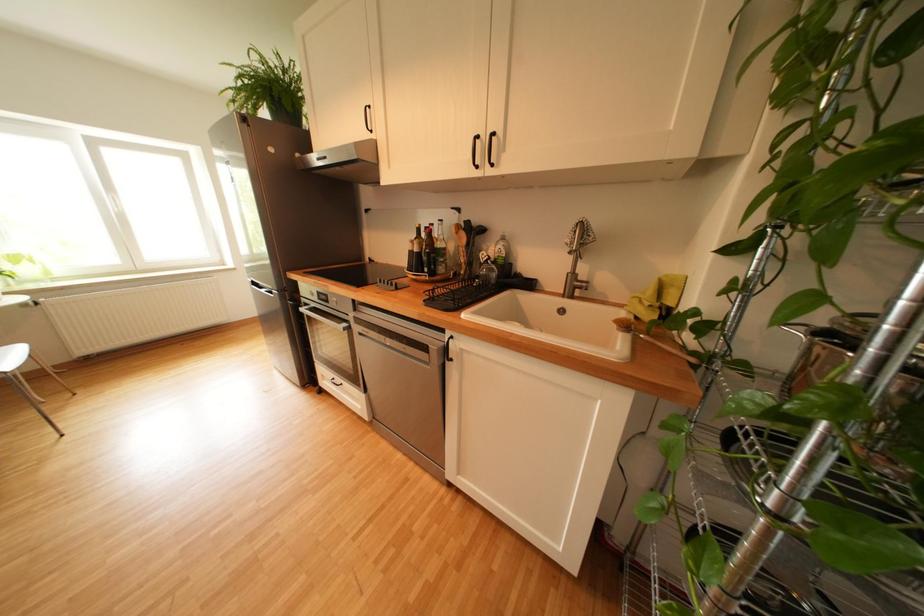
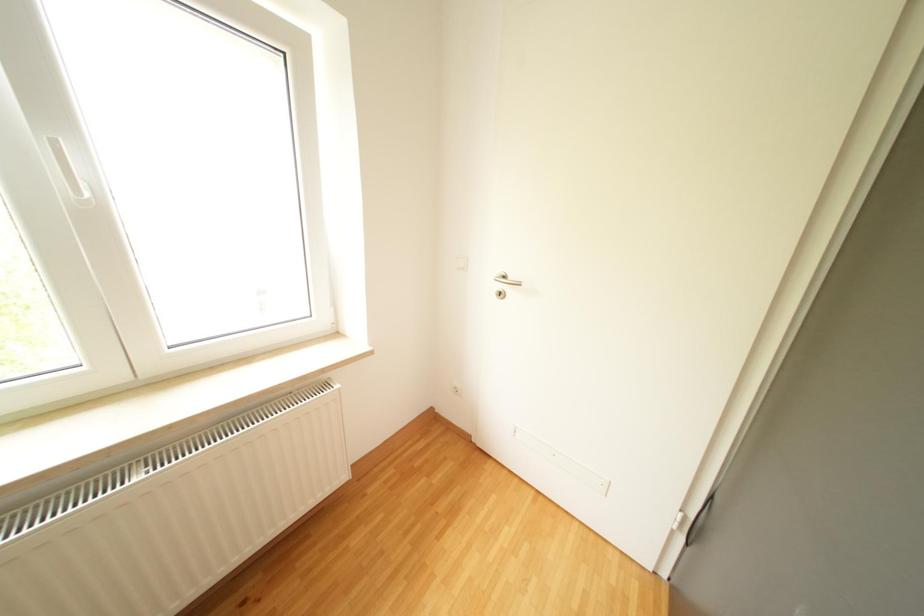
Which direction would the cameraman need to move to produce the second image?

The movement direction of the cameraman is left, forward.